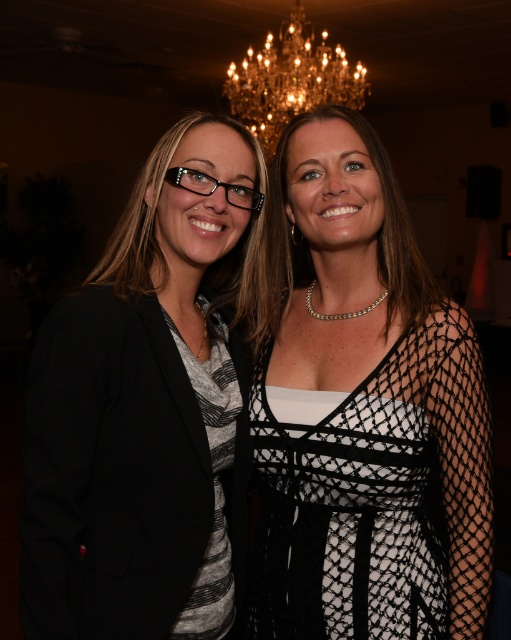
Question: Estimate the real-world distances between objects in this image. Which object is closer to the black matte blazer at left?

Choices:
 (A) crystal chandelier at upper center
 (B) black mesh dress at center

Answer: (B)

Question: Which point appears farthest from the camera in this image?

Choices:
 (A) (413, 493)
 (B) (359, 70)

Answer: (B)

Question: Does black mesh dress at center have a lesser width compared to crystal chandelier at upper center?

Choices:
 (A) yes
 (B) no

Answer: (A)

Question: Which point appears closest to the camera in this image?

Choices:
 (A) (444, 381)
 (B) (343, 51)

Answer: (A)

Question: Considering the relative positions of black matte blazer at left and crystal chandelier at upper center in the image provided, where is black matte blazer at left located with respect to crystal chandelier at upper center?

Choices:
 (A) right
 (B) left

Answer: (B)

Question: Is black mesh dress at center thinner than black matte blazer at left?

Choices:
 (A) no
 (B) yes

Answer: (A)